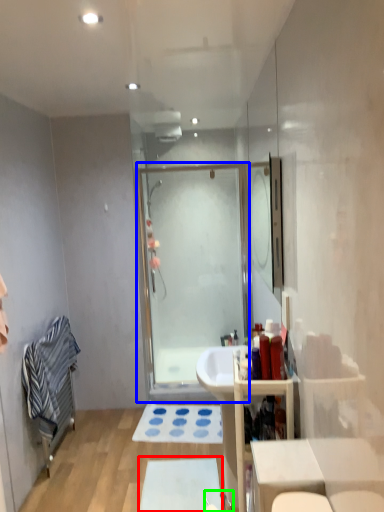
Question: Which object is positioned closest to bath mat (highlighted by a red box)? Select from screen door (highlighted by a blue box) and faucet (highlighted by a green box).

Choices:
 (A) screen door
 (B) faucet

Answer: (B)